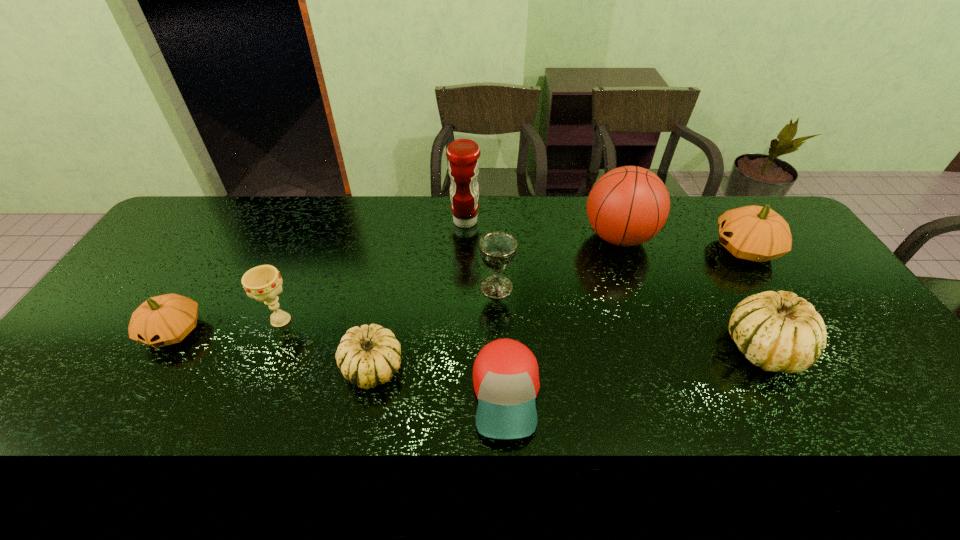
Locate an element on the screen. The height and width of the screenshot is (540, 960). free location located on the back of the farther chalice is located at coordinates (495, 247).

Locate an element on the screen. The width and height of the screenshot is (960, 540). vacant space located on the left of the left chalice is located at coordinates (164, 320).

The width and height of the screenshot is (960, 540). Identify the location of vacant space situated 0.380m on the left of the right white gourd. (580, 348).

This screenshot has height=540, width=960. I want to click on vacant space located 0.260m on the side of the nearer orange gourd with the carved face, so click(97, 455).

You are a GUI agent. You are given a task and a screenshot of the screen. Output one action in this format:
    pyautogui.click(x=<x>, y=<y>)
    Task: Click on the free space located 0.190m on the left of the second gourd from left to right
    
    Given the screenshot: What is the action you would take?
    pyautogui.click(x=267, y=368)

You are a GUI agent. You are given a task and a screenshot of the screen. Output one action in this format:
    pyautogui.click(x=<x>, y=<y>)
    Task: Click on the condiment that is at the far edge
    The width and height of the screenshot is (960, 540).
    Given the screenshot: What is the action you would take?
    pyautogui.click(x=463, y=165)

The width and height of the screenshot is (960, 540). I want to click on basketball that is at the far edge, so click(x=627, y=206).

Locate an element on the screen. The height and width of the screenshot is (540, 960). gourd located at the far edge is located at coordinates (754, 233).

Find the location of a particular element. This screenshot has width=960, height=540. object at the near edge is located at coordinates (505, 374).

Where is `object that is at the left edge`? The width and height of the screenshot is (960, 540). object that is at the left edge is located at coordinates (167, 319).